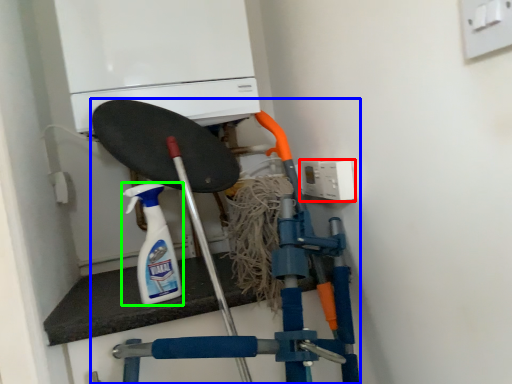
Question: Based on their relative distances, which object is nearer to electric outlet (highlighted by a red box)? Choose from vacuum (highlighted by a blue box) and cleaning product (highlighted by a green box).

Choices:
 (A) vacuum
 (B) cleaning product

Answer: (A)